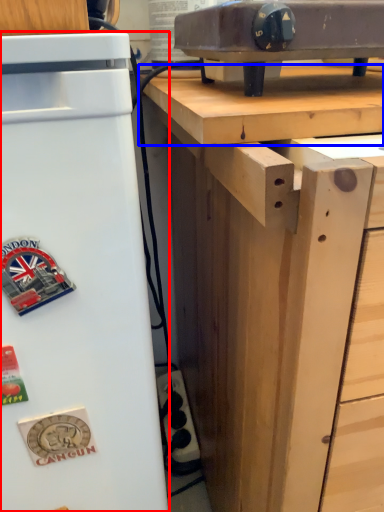
Question: Among these objects, which one is farthest to the camera, refrigerator (highlighted by a red box) or wood (highlighted by a blue box)?

Choices:
 (A) refrigerator
 (B) wood

Answer: (B)